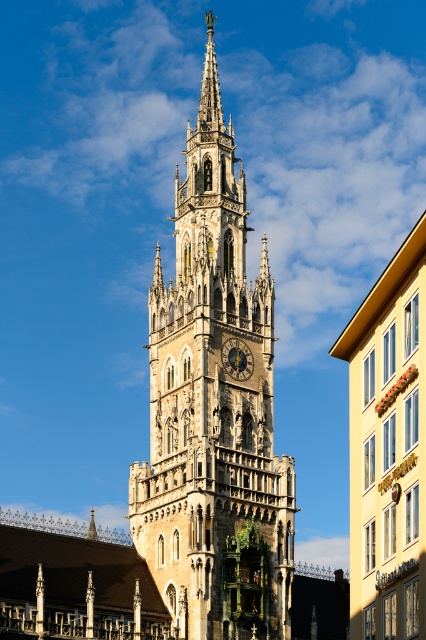
Consider the image. You are standing in front of the New Town Hall Tower in Munich. You notice two points marked on the tower facade. The first point is at coordinate point (233,472) and the second is at point (236,378). Which of these two points is positioned closer to your viewpoint?

Point (233,472) is closer to the viewer than point (236,378).

You are standing in front of the New Town Hall Tower in Munich and want to locate the golden stone clock tower at center. Which direction should you face to see the point at coordinates point (213,410)?

The point at coordinates point (213,410) is on the golden stone clock tower at center, so you should face the center of the tower to see it.

You are a tourist standing in front of the New Town Hall Tower in Munich. You notice the yellow matte building at right and the golden polished metal clock at center. Which object is positioned to the right of the other?

The yellow matte building at right is positioned to the right of the golden polished metal clock at center.